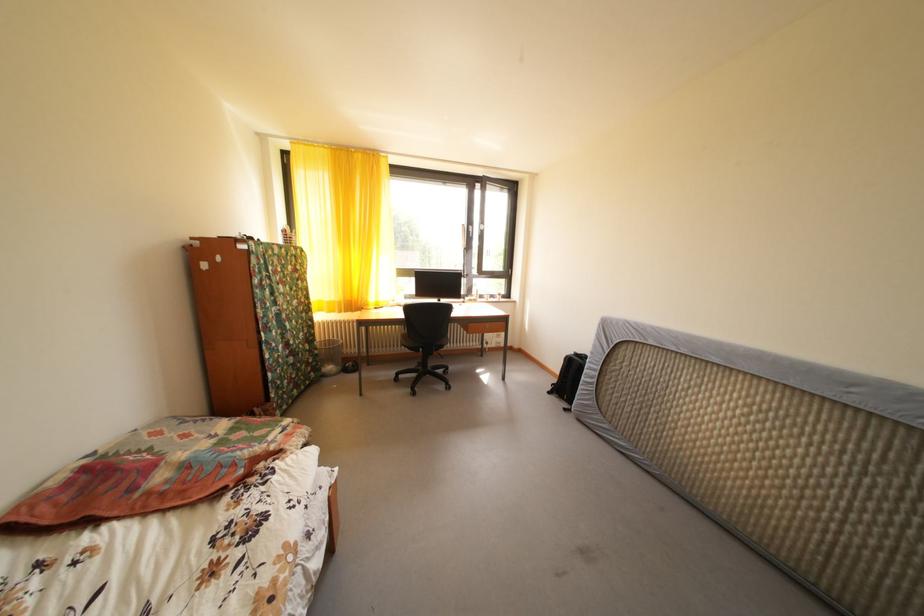
Find the location of a particular element. The width and height of the screenshot is (924, 616). black backpack is located at coordinates (568, 378).